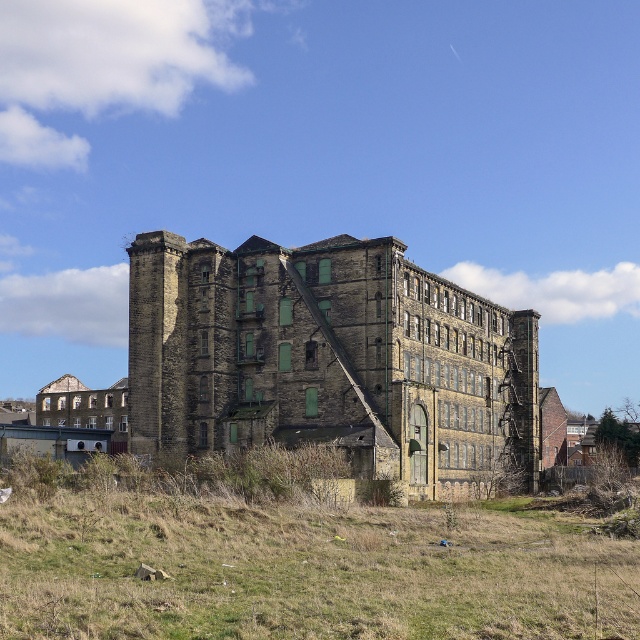
Who is lower down, green grass at lower center or brown stone building at center?

green grass at lower center

Does green grass at lower center have a lesser height compared to brown stone building at center?

Indeed, green grass at lower center has a lesser height compared to brown stone building at center.

Who is more forward, [204,596] or [412,368]?

Point [204,596]

Find the location of a particular element. This screenshot has width=640, height=640. green grass at lower center is located at coordinates (307, 570).